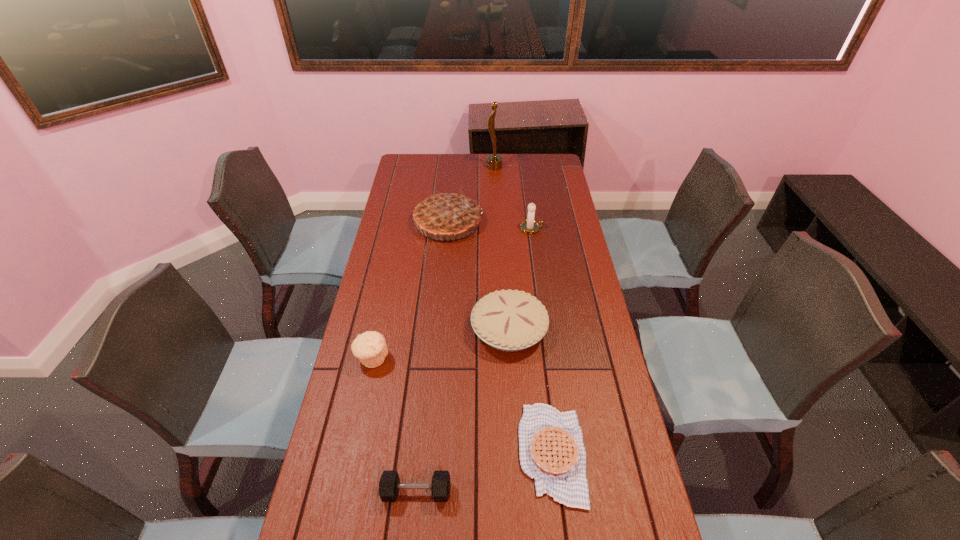
Locate an element on the screen. pie that is at the left edge is located at coordinates (445, 214).

The width and height of the screenshot is (960, 540). Find the location of `muffin that is at the left edge`. muffin that is at the left edge is located at coordinates (370, 348).

Identify the location of dumbbell located in the left edge section of the desktop. (389, 485).

You are a GUI agent. You are given a task and a screenshot of the screen. Output one action in this format:
    pyautogui.click(x=<x>, y=<y>)
    Task: Click on the candle holder at the right edge
    The width and height of the screenshot is (960, 540).
    Given the screenshot: What is the action you would take?
    pyautogui.click(x=530, y=226)

Locate an element on the screen. pie that is at the right edge is located at coordinates (551, 448).

You are a GUI agent. You are given a task and a screenshot of the screen. Output one action in this format:
    pyautogui.click(x=<x>, y=<y>)
    Task: Click on the free space at the left edge of the desktop
    The height and width of the screenshot is (540, 960).
    Given the screenshot: What is the action you would take?
    pyautogui.click(x=408, y=199)

In the image, there is a desktop. Where is `vacant area at the right edge`? vacant area at the right edge is located at coordinates (578, 360).

The height and width of the screenshot is (540, 960). Find the location of `free spot between the muffin and the second tallest pie`. free spot between the muffin and the second tallest pie is located at coordinates (441, 343).

Where is `empty location between the second tallest pie and the dumbbell`? empty location between the second tallest pie and the dumbbell is located at coordinates (463, 410).

Where is `free point between the tallest object and the second shortest pie`? The width and height of the screenshot is (960, 540). free point between the tallest object and the second shortest pie is located at coordinates (502, 248).